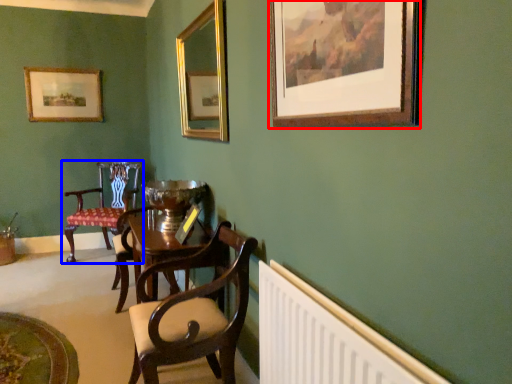
Question: Which point is closer to the camera, picture frame (highlighted by a red box) or chair (highlighted by a blue box)?

Choices:
 (A) picture frame
 (B) chair

Answer: (A)